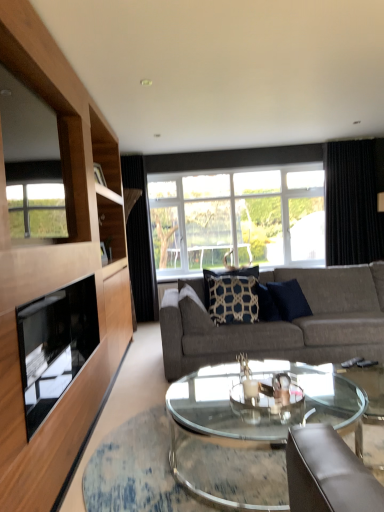
This screenshot has height=512, width=384. Identify the location of dark blue textured pillow at center, the first pillow when ordered from right to left. (289, 300).

What do you see at coordinates (237, 219) in the screenshot?
I see `transparent glass window at center` at bounding box center [237, 219].

Describe the element at coordinates (140, 242) in the screenshot. I see `black textured curtain at center, which is the second curtain from right to left` at that location.

What is the approximate height of navy blue textured pillow at center, which is counted as the second pillow, starting from the right?

navy blue textured pillow at center, which is counted as the second pillow, starting from the right, is 58.86 centimeters in height.

What do you see at coordinates (286, 323) in the screenshot?
I see `gray fabric couch at center` at bounding box center [286, 323].

Find the location of `black fabric curtain at right, positioned as the second curtain in left-to-right order`. black fabric curtain at right, positioned as the second curtain in left-to-right order is located at coordinates (353, 201).

Image resolution: width=384 pixels, height=512 pixels. Describe the element at coordinates (353, 201) in the screenshot. I see `black fabric curtain at right, which appears as the 1th curtain when viewed from the right` at that location.

In order to click on black glass fireplace at left in this screenshot , I will do `click(55, 345)`.

Find the location of `dark blue textured pillow at center, acting as the second pillow starting from the left`. dark blue textured pillow at center, acting as the second pillow starting from the left is located at coordinates (289, 300).

Considering the relative sizes of navy blue textured pillow at center, the first pillow viewed from the left, and transparent glass window at center in the image provided, is navy blue textured pillow at center, the first pillow viewed from the left, thinner than transparent glass window at center?

Indeed, navy blue textured pillow at center, the first pillow viewed from the left, has a lesser width compared to transparent glass window at center.

Can we say navy blue textured pillow at center, the first pillow viewed from the left, lies outside transparent glass window at center?

Absolutely, navy blue textured pillow at center, the first pillow viewed from the left, is external to transparent glass window at center.

Is navy blue textured pillow at center, the first pillow viewed from the left, smaller than transparent glass window at center?

Correct, navy blue textured pillow at center, the first pillow viewed from the left, occupies less space than transparent glass window at center.

Based on the photo, considering the sizes of objects navy blue textured pillow at center, the first pillow viewed from the left, and transparent glass window at center in the image provided, who is taller, navy blue textured pillow at center, the first pillow viewed from the left, or transparent glass window at center?

transparent glass window at center is taller.

Can you confirm if transparent glass window at center is positioned to the left of black fabric curtain at right, which appears as the 1th curtain when viewed from the right?

Yes, transparent glass window at center is to the left of black fabric curtain at right, which appears as the 1th curtain when viewed from the right.

Which object is further away from the camera taking this photo, transparent glass window at center or black fabric curtain at right, positioned as the second curtain in left-to-right order?

transparent glass window at center is behind.

From a real-world perspective, is transparent glass window at center located beneath black fabric curtain at right, which appears as the 1th curtain when viewed from the right?

Yes.

How distant is black fabric curtain at right, positioned as the second curtain in left-to-right order, from navy blue textured pillow at center, which is counted as the second pillow, starting from the right?

black fabric curtain at right, positioned as the second curtain in left-to-right order, and navy blue textured pillow at center, which is counted as the second pillow, starting from the right, are 8.44 feet apart.

From the image's perspective, is black fabric curtain at right, which appears as the 1th curtain when viewed from the right, below navy blue textured pillow at center, the first pillow viewed from the left?

No, from the image's perspective, black fabric curtain at right, which appears as the 1th curtain when viewed from the right, is not beneath navy blue textured pillow at center, the first pillow viewed from the left.

Looking at this image, is black fabric curtain at right, which appears as the 1th curtain when viewed from the right, surrounding navy blue textured pillow at center, the first pillow viewed from the left?

No, navy blue textured pillow at center, the first pillow viewed from the left, is located outside of black fabric curtain at right, which appears as the 1th curtain when viewed from the right.

Can you confirm if black fabric curtain at right, which appears as the 1th curtain when viewed from the right, is smaller than navy blue textured pillow at center, which is counted as the second pillow, starting from the right?

No.

Where is `the 1st curtain behind the gray fabric couch at center`? The width and height of the screenshot is (384, 512). the 1st curtain behind the gray fabric couch at center is located at coordinates (140, 242).

Could you tell me if gray fabric couch at center is facing black textured curtain at center, placed as the first curtain when sorted from left to right?

No, gray fabric couch at center is not oriented towards black textured curtain at center, placed as the first curtain when sorted from left to right.

Are gray fabric couch at center and black textured curtain at center, placed as the first curtain when sorted from left to right, making contact?

gray fabric couch at center is not next to black textured curtain at center, placed as the first curtain when sorted from left to right, and they're not touching.

Which object is further away from the camera taking this photo, gray fabric couch at center or black textured curtain at center, which is the second curtain from right to left?

black textured curtain at center, which is the second curtain from right to left, is behind.

Is transparent glass window at center turned away from black textured curtain at center, which is the second curtain from right to left?

No, black textured curtain at center, which is the second curtain from right to left, is not at the back of transparent glass window at center.

Which is behind, point (233, 178) or point (136, 222)?

Positioned behind is point (136, 222).

Is transparent glass window at center in contact with black textured curtain at center, which is the second curtain from right to left?

No, transparent glass window at center is not touching black textured curtain at center, which is the second curtain from right to left.

In terms of width, does transparent glass window at center look wider or thinner when compared to black textured curtain at center, which is the second curtain from right to left?

Clearly, transparent glass window at center has more width compared to black textured curtain at center, which is the second curtain from right to left.

Is the depth of dark blue textured pillow at center, acting as the second pillow starting from the left, greater than that of black fabric curtain at right, which appears as the 1th curtain when viewed from the right?

That is False.

Is dark blue textured pillow at center, the first pillow when ordered from right to left, facing away from black fabric curtain at right, positioned as the second curtain in left-to-right order?

No, dark blue textured pillow at center, the first pillow when ordered from right to left,'s orientation is not away from black fabric curtain at right, positioned as the second curtain in left-to-right order.

From the image's perspective, which is above, dark blue textured pillow at center, the first pillow when ordered from right to left, or black fabric curtain at right, which appears as the 1th curtain when viewed from the right?

black fabric curtain at right, which appears as the 1th curtain when viewed from the right, from the image's perspective.

Is dark blue textured pillow at center, acting as the second pillow starting from the left, taller or shorter than black fabric curtain at right, positioned as the second curtain in left-to-right order?

Clearly, dark blue textured pillow at center, acting as the second pillow starting from the left, is shorter compared to black fabric curtain at right, positioned as the second curtain in left-to-right order.

Considering the relative sizes of transparent glass coffee table at center and navy blue textured pillow at center, which is counted as the second pillow, starting from the right, in the image provided, is transparent glass coffee table at center thinner than navy blue textured pillow at center, which is counted as the second pillow, starting from the right,?

No, transparent glass coffee table at center is not thinner than navy blue textured pillow at center, which is counted as the second pillow, starting from the right.

Considering the positions of objects transparent glass coffee table at center and navy blue textured pillow at center, which is counted as the second pillow, starting from the right, in the image provided, who is more to the left, transparent glass coffee table at center or navy blue textured pillow at center, which is counted as the second pillow, starting from the right,?

navy blue textured pillow at center, which is counted as the second pillow, starting from the right.

From the image's perspective, which is below, transparent glass coffee table at center or navy blue textured pillow at center, which is counted as the second pillow, starting from the right?

transparent glass coffee table at center, from the image's perspective.

At what (x,y) coordinates should I click in order to perform the action: click on window above the navy blue textured pillow at center, which is counted as the second pillow, starting from the right (from the image's perspective). Please return your answer as a coordinate pair (x, y). This screenshot has width=384, height=512. Looking at the image, I should click on (237, 219).

You are a GUI agent. You are given a task and a screenshot of the screen. Output one action in this format:
    pyautogui.click(x=<x>, y=<y>)
    Task: Click on the curtain that is above the transparent glass window at center (from a real-world perspective)
    This screenshot has height=512, width=384.
    Given the screenshot: What is the action you would take?
    pyautogui.click(x=353, y=201)

Considering their positions, is navy blue textured pillow at center, which is counted as the second pillow, starting from the right, positioned closer to gray fabric couch at center than black fabric curtain at right, which appears as the 1th curtain when viewed from the right?

navy blue textured pillow at center, which is counted as the second pillow, starting from the right.

Based on their spatial positions, is dark blue textured pillow at center, acting as the second pillow starting from the left, or black textured curtain at center, placed as the first curtain when sorted from left to right, closer to black fabric curtain at right, positioned as the second curtain in left-to-right order?

dark blue textured pillow at center, acting as the second pillow starting from the left, is positioned closer to the anchor black fabric curtain at right, positioned as the second curtain in left-to-right order.

Which object lies nearer to the anchor point black glass fireplace at left, transparent glass window at center or gray fabric couch at center?

gray fabric couch at center lies closer to black glass fireplace at left than the other object.

From the image, which object appears to be nearer to dark blue textured pillow at center, the first pillow when ordered from right to left, black fabric curtain at right, which appears as the 1th curtain when viewed from the right, or transparent glass coffee table at center?

transparent glass coffee table at center lies closer to dark blue textured pillow at center, the first pillow when ordered from right to left, than the other object.

From the picture: When comparing their distances from black fabric curtain at right, which appears as the 1th curtain when viewed from the right, does black glass fireplace at left or transparent glass coffee table at center seem closer?

transparent glass coffee table at center is closer to black fabric curtain at right, which appears as the 1th curtain when viewed from the right.

Considering their positions, is transparent glass coffee table at center positioned further to navy blue textured pillow at center, which is counted as the second pillow, starting from the right, than black fabric curtain at right, which appears as the 1th curtain when viewed from the right?

black fabric curtain at right, which appears as the 1th curtain when viewed from the right.

Considering their positions, is black textured curtain at center, which is the second curtain from right to left, positioned further to black glass fireplace at left than gray fabric couch at center?

The object further to black glass fireplace at left is black textured curtain at center, which is the second curtain from right to left.

Considering their positions, is navy blue textured pillow at center, the first pillow viewed from the left, positioned closer to gray fabric couch at center than black glass fireplace at left?

navy blue textured pillow at center, the first pillow viewed from the left, lies closer to gray fabric couch at center than the other object.

Find the location of a particular element. The height and width of the screenshot is (512, 384). pillow between dark blue textured pillow at center, acting as the second pillow starting from the left, and black fabric curtain at right, which appears as the 1th curtain when viewed from the right, along the z-axis is located at coordinates (233, 298).

The image size is (384, 512). Find the location of `studio couch between black glass fireplace at left and navy blue textured pillow at center, which is counted as the second pillow, starting from the right, in the front-back direction`. studio couch between black glass fireplace at left and navy blue textured pillow at center, which is counted as the second pillow, starting from the right, in the front-back direction is located at coordinates (286, 323).

Where is `window between black textured curtain at center, which is the second curtain from right to left, and black fabric curtain at right, which appears as the 1th curtain when viewed from the right`? This screenshot has height=512, width=384. window between black textured curtain at center, which is the second curtain from right to left, and black fabric curtain at right, which appears as the 1th curtain when viewed from the right is located at coordinates (237, 219).

Where is `studio couch between transparent glass coffee table at center and dark blue textured pillow at center, acting as the second pillow starting from the left, from front to back`? studio couch between transparent glass coffee table at center and dark blue textured pillow at center, acting as the second pillow starting from the left, from front to back is located at coordinates (286, 323).